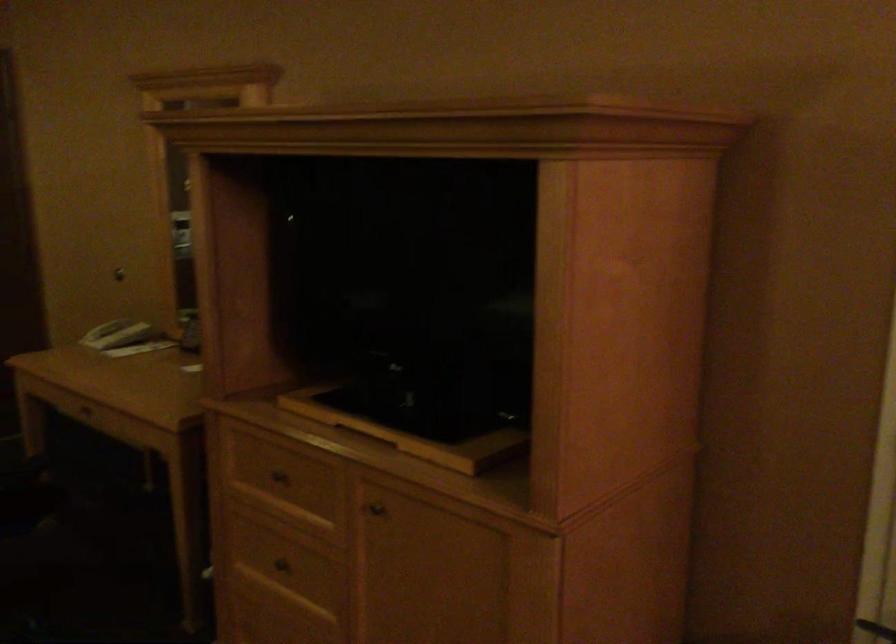
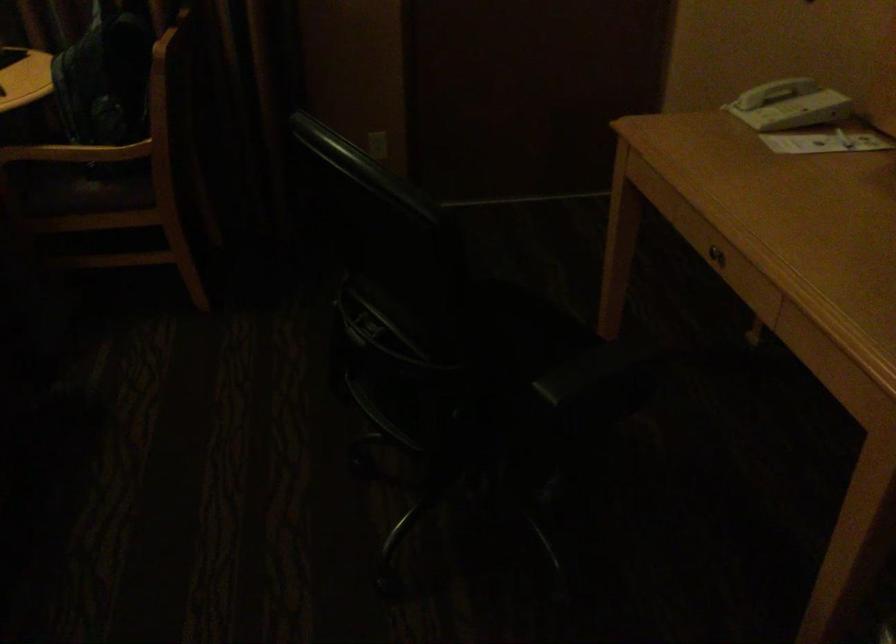
Locate, in the second image, the point that corresponds to pixel 101 326 in the first image.

(768, 91)